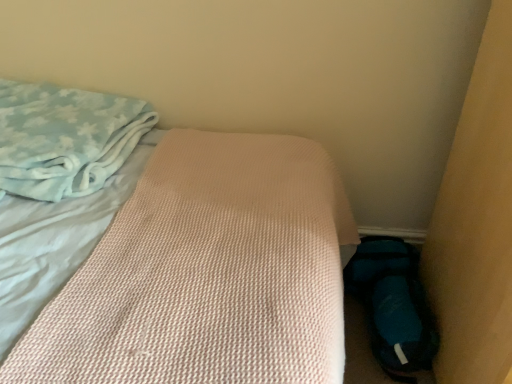
Locate an element on the screen. Image resolution: width=512 pixels, height=384 pixels. free space above blue fabric shoe at lower right (from a real-world perspective) is located at coordinates (396, 306).